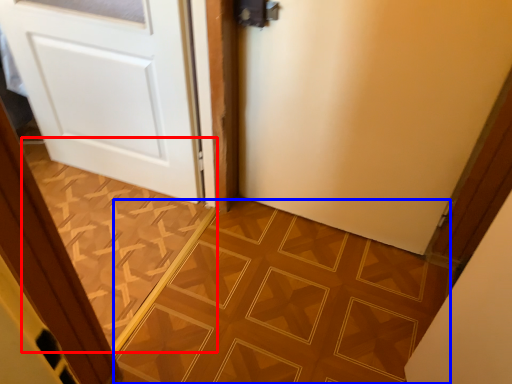
Question: Which point is closer to the camera, ceramic tile (highlighted by a red box) or ceramic tile (highlighted by a blue box)?

Choices:
 (A) ceramic tile
 (B) ceramic tile

Answer: (B)